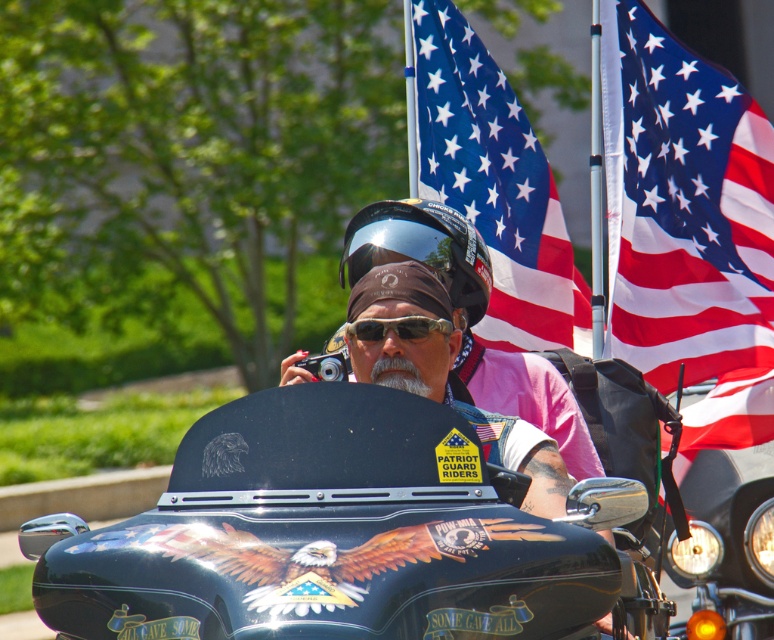
Question: In this image, where is glossy black helmet at center located relative to matte black goggles at center?

Choices:
 (A) left
 (B) right

Answer: (B)

Question: Among these points, which one is farthest from the camera?

Choices:
 (A) (389, 252)
 (B) (603, 45)

Answer: (B)

Question: Which point is farther to the camera?

Choices:
 (A) (550, 224)
 (B) (615, 186)
 (C) (353, 330)

Answer: (A)

Question: Which object appears closest to the camera in this image?

Choices:
 (A) blue fabric flag at upper center
 (B) red-white-blue fabric flag at upper right
 (C) matte black goggles at center

Answer: (C)

Question: Is glossy black motorcycle at center thinner than red-white-blue fabric flag at upper right?

Choices:
 (A) yes
 (B) no

Answer: (B)

Question: Observing the image, what is the correct spatial positioning of red-white-blue fabric flag at upper right in reference to blue fabric flag at upper center?

Choices:
 (A) left
 (B) right

Answer: (B)